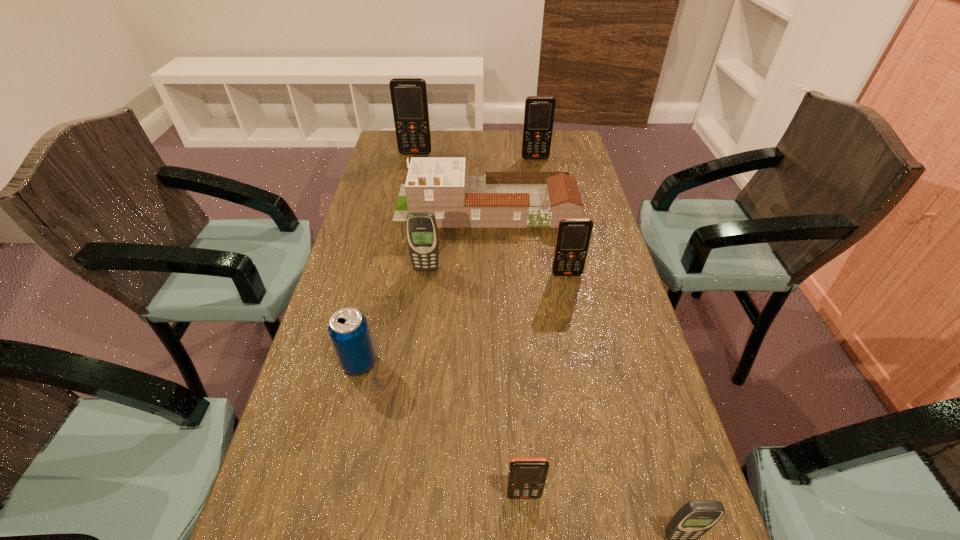
At what (x,y) coordinates should I click in order to perform the action: click on the tallest object. Please return your answer as a coordinate pair (x, y). The width and height of the screenshot is (960, 540). Looking at the image, I should click on (409, 99).

This screenshot has height=540, width=960. I want to click on the farthest cellular telephone, so click(x=409, y=99).

In order to click on the second farthest orange cellular telephone in this screenshot , I will do `click(539, 112)`.

This screenshot has width=960, height=540. In order to click on the seventh nearest object in this screenshot , I will do `click(539, 112)`.

Where is `the third farthest object`? The width and height of the screenshot is (960, 540). the third farthest object is located at coordinates (440, 186).

Where is `dollhouse`? dollhouse is located at coordinates (440, 186).

Where is `the farther gray cellular telephone`? the farther gray cellular telephone is located at coordinates (421, 229).

What are the coordinates of `the left gray cellular telephone` in the screenshot? It's located at (421, 229).

The image size is (960, 540). I want to click on the third biggest orange cellular telephone, so tap(573, 237).

This screenshot has width=960, height=540. What are the coordinates of `blue pop soda` in the screenshot? It's located at (348, 329).